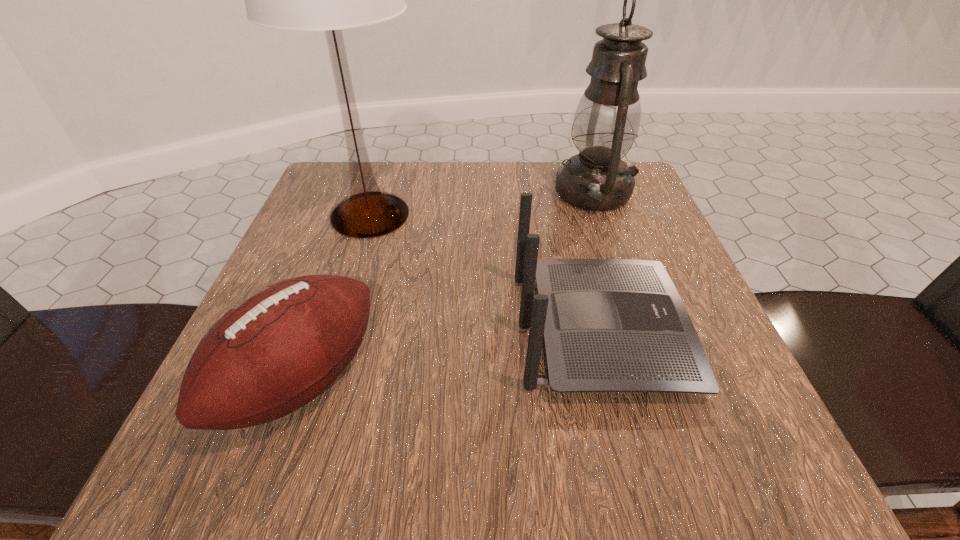
Image resolution: width=960 pixels, height=540 pixels. In the image, there is a desktop. In order to click on vacant region at the far left corner in this screenshot , I will do `click(323, 191)`.

In the image, there is a desktop. At what (x,y) coordinates should I click in order to perform the action: click on vacant space at the near left corner. Please return your answer as a coordinate pair (x, y). The height and width of the screenshot is (540, 960). Looking at the image, I should click on (221, 463).

This screenshot has height=540, width=960. I want to click on vacant area that lies between the second tallest object and the tallest object, so click(482, 204).

Find the location of a particular element. This screenshot has height=540, width=960. blank region between the second tallest object and the tallest object is located at coordinates (482, 204).

You are a GUI agent. You are given a task and a screenshot of the screen. Output one action in this format:
    pyautogui.click(x=<x>, y=<y>)
    Task: Click on the free space between the tallest object and the third shortest object
    The height and width of the screenshot is (540, 960).
    Given the screenshot: What is the action you would take?
    pyautogui.click(x=482, y=204)

Find the location of a particular element. Image resolution: width=960 pixels, height=540 pixels. vacant space that's between the oil lamp and the table lamp is located at coordinates (482, 204).

Where is `vacant space in between the table lamp and the oil lamp`? The height and width of the screenshot is (540, 960). vacant space in between the table lamp and the oil lamp is located at coordinates 482,204.

You are a GUI agent. You are given a task and a screenshot of the screen. Output one action in this format:
    pyautogui.click(x=<x>, y=<y>)
    Task: Click on the vacant point located between the router and the table lamp
    
    Given the screenshot: What is the action you would take?
    pyautogui.click(x=485, y=273)

Locate which object ranks second in proximity to the router. Please provide its 2D coordinates. Your answer should be formatted as a tuple, i.e. [(x, y)], where the tuple contains the x and y coordinates of a point satisfying the conditions above.

[(329, 0)]

Locate which object is the closest to the oil lamp. Please provide its 2D coordinates. Your answer should be formatted as a tuple, i.e. [(x, y)], where the tuple contains the x and y coordinates of a point satisfying the conditions above.

[(610, 325)]